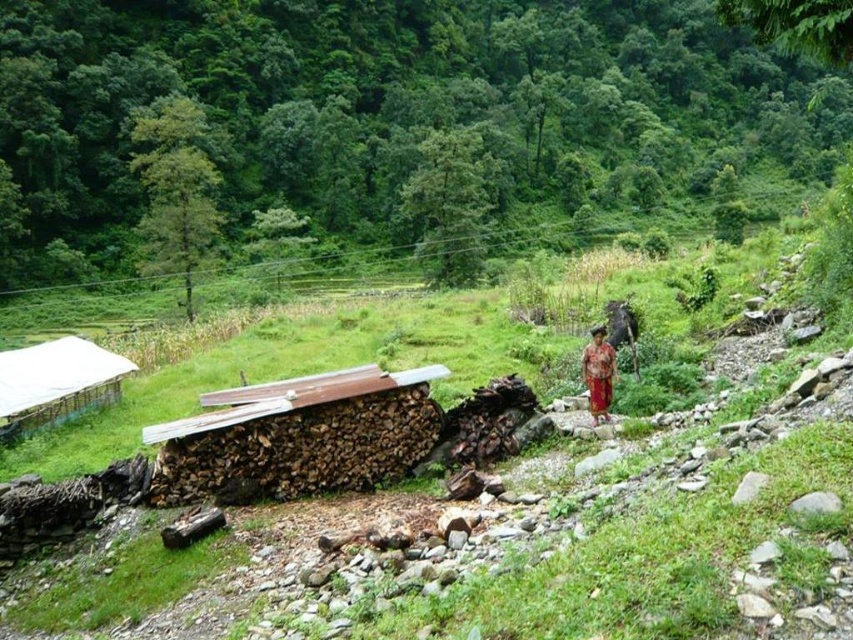
Is white plastic hut at lower left bigger than red fabric dress at center?

Yes.

How much distance is there between white plastic hut at lower left and red fabric dress at center?

white plastic hut at lower left and red fabric dress at center are 12.70 meters apart.

Where is `white plastic hut at lower left`? The height and width of the screenshot is (640, 853). white plastic hut at lower left is located at coordinates (56, 381).